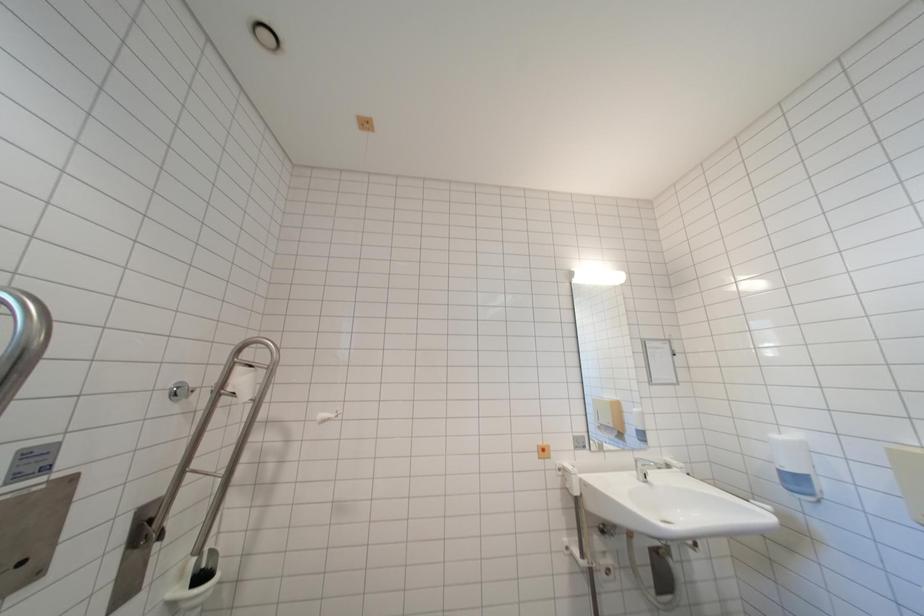
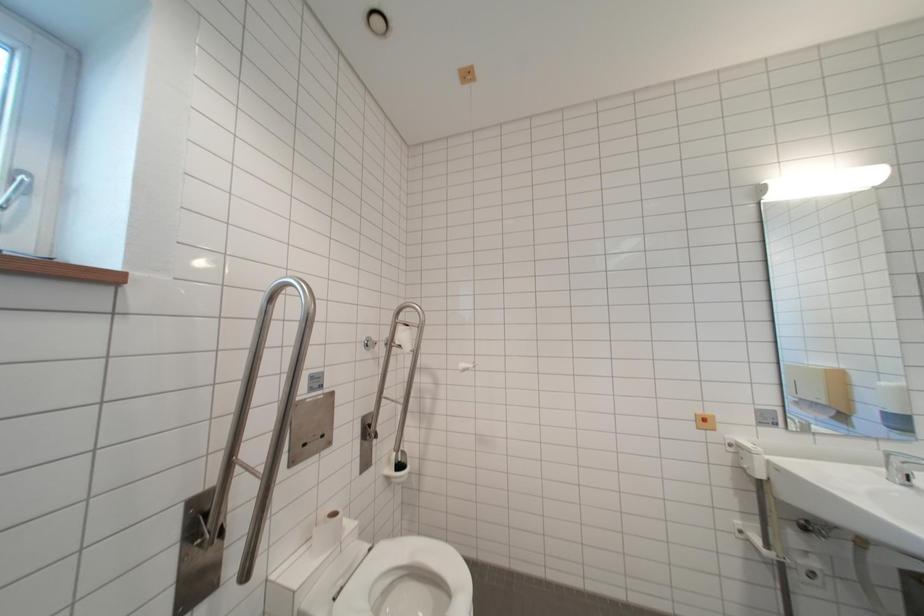
Question: The images are taken continuously from a first-person perspective. In which direction are you moving?

Choices:
 (A) Left
 (B) Right
 (C) Forward
 (D) Backward

Answer: (A)